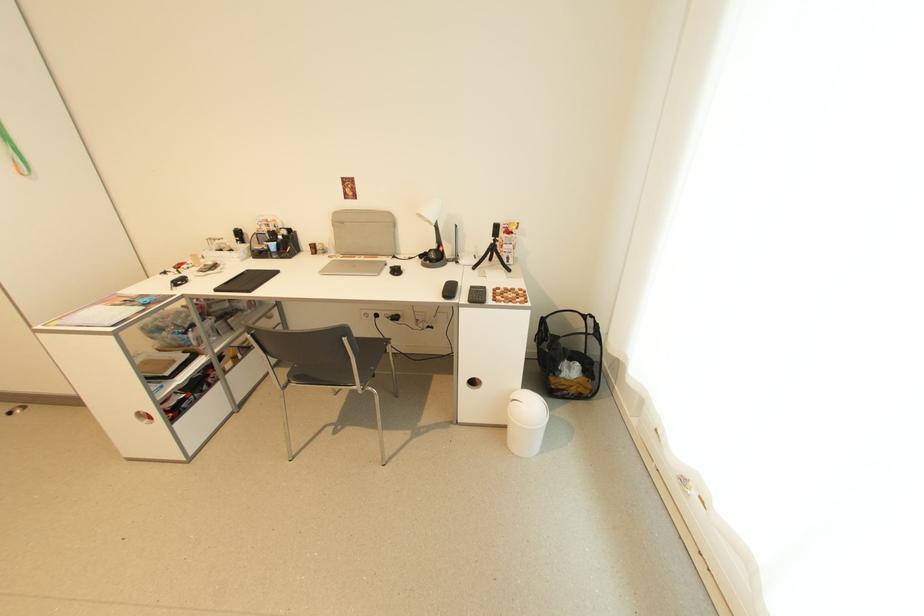
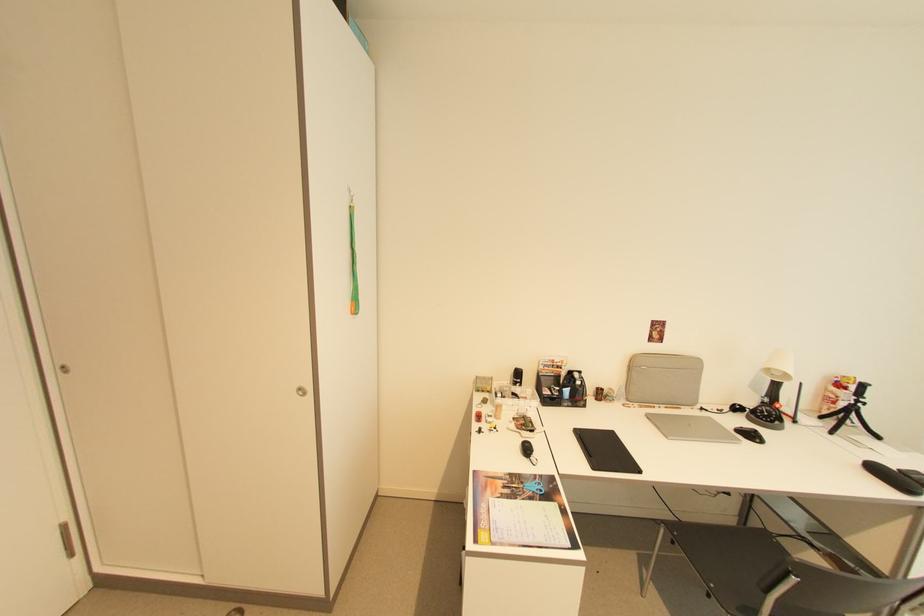
The point at (345, 223) is marked in the first image. Where is the corresponding point in the second image?

(638, 366)